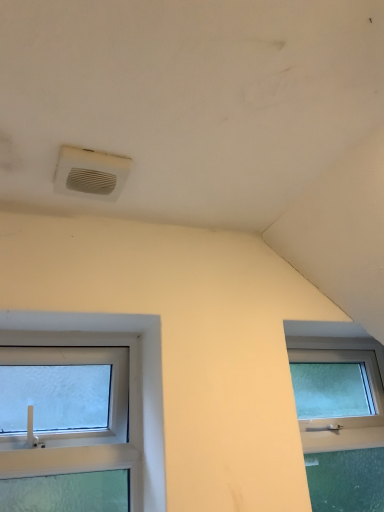
Question: Is clear glass window at lower left completely or partially outside of white plastic air conditioning at upper center?

Choices:
 (A) yes
 (B) no

Answer: (A)

Question: Is clear glass window at lower left wider than white plastic air conditioning at upper center?

Choices:
 (A) yes
 (B) no

Answer: (B)

Question: Are clear glass window at lower left and white plastic air conditioning at upper center beside each other?

Choices:
 (A) no
 (B) yes

Answer: (A)

Question: Can you confirm if clear glass window at lower left is bigger than white plastic air conditioning at upper center?

Choices:
 (A) no
 (B) yes

Answer: (B)

Question: Considering the relative sizes of clear glass window at lower left and white plastic air conditioning at upper center in the image provided, is clear glass window at lower left thinner than white plastic air conditioning at upper center?

Choices:
 (A) no
 (B) yes

Answer: (B)

Question: Does clear glass window at lower left appear on the left side of white plastic air conditioning at upper center?

Choices:
 (A) no
 (B) yes

Answer: (B)

Question: Is white plastic air conditioning at upper center shorter than clear glass window at lower left?

Choices:
 (A) yes
 (B) no

Answer: (A)

Question: Is white plastic air conditioning at upper center facing towards clear glass window at lower left?

Choices:
 (A) yes
 (B) no

Answer: (B)

Question: Considering the relative positions of white plastic air conditioning at upper center and clear glass window at lower left in the image provided, is white plastic air conditioning at upper center to the left of clear glass window at lower left from the viewer's perspective?

Choices:
 (A) yes
 (B) no

Answer: (B)

Question: Considering the relative sizes of white plastic air conditioning at upper center and clear glass window at lower left in the image provided, is white plastic air conditioning at upper center bigger than clear glass window at lower left?

Choices:
 (A) no
 (B) yes

Answer: (A)

Question: From a real-world perspective, is white plastic air conditioning at upper center located higher than clear glass window at lower left?

Choices:
 (A) yes
 (B) no

Answer: (A)

Question: Is white plastic air conditioning at upper center thinner than clear glass window at lower left?

Choices:
 (A) no
 (B) yes

Answer: (A)

Question: Is point [x=109, y=185] positioned closer to the camera than point [x=8, y=310]?

Choices:
 (A) closer
 (B) farther

Answer: (A)